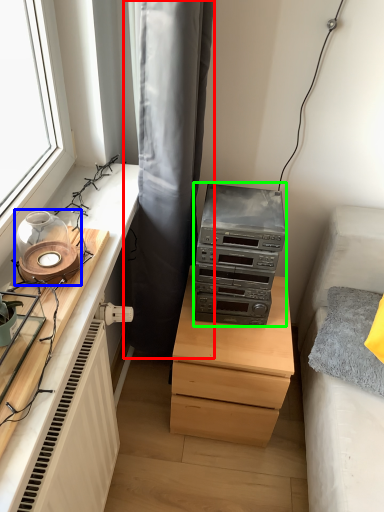
Question: Which is farther away from curtain (highlighted by a red box)? candle holder (highlighted by a blue box) or stereo (highlighted by a green box)?

Choices:
 (A) candle holder
 (B) stereo

Answer: (A)